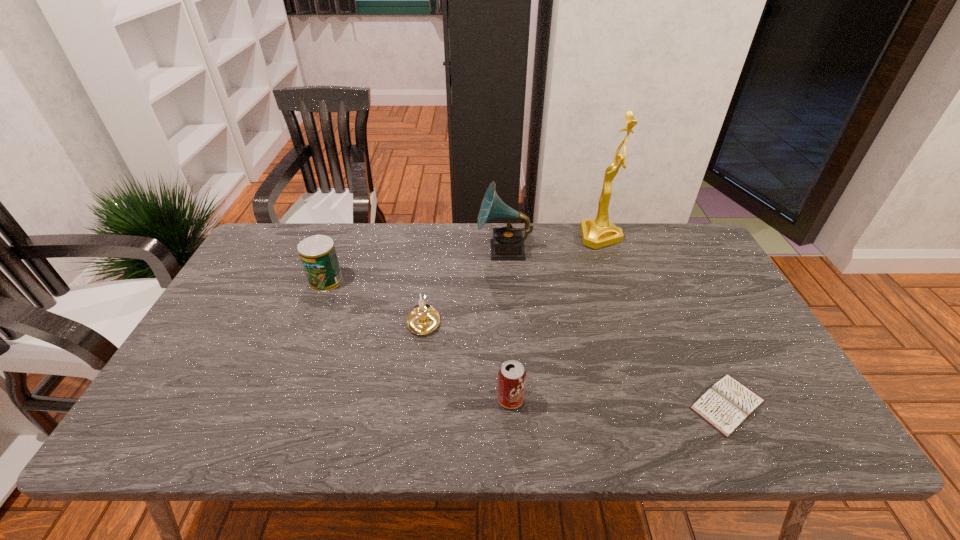
I want to click on vacant region located on the front-facing side of the tallest object, so click(517, 237).

You are a GUI agent. You are given a task and a screenshot of the screen. Output one action in this format:
    pyautogui.click(x=<x>, y=<y>)
    Task: Click on the vacant space located 0.350m from the horn of the second tallest object
    The width and height of the screenshot is (960, 540).
    Given the screenshot: What is the action you would take?
    pyautogui.click(x=370, y=250)

At what (x,y) coordinates should I click in order to perform the action: click on vacant region located 0.140m from the horn of the second tallest object. Please return your answer as a coordinate pair (x, y). The height and width of the screenshot is (540, 960). Looking at the image, I should click on click(434, 250).

The image size is (960, 540). In order to click on vacant space situated from the horn of the second tallest object in this screenshot , I will do `click(403, 250)`.

I want to click on free space located on the right of the fourth nearest object, so click(x=416, y=281).

The height and width of the screenshot is (540, 960). I want to click on vacant space positioned 0.310m on the right of the soda can, so click(659, 399).

Identify the location of vacant space located 0.270m on the handle side of the third nearest object. (434, 247).

This screenshot has width=960, height=540. What are the coordinates of `vacant region located on the handle side of the third nearest object` in the screenshot? It's located at (430, 276).

This screenshot has width=960, height=540. I want to click on free region located 0.120m on the handle side of the third nearest object, so (x=430, y=276).

The image size is (960, 540). In order to click on vacant region located on the left of the diary in this screenshot , I will do `click(626, 404)`.